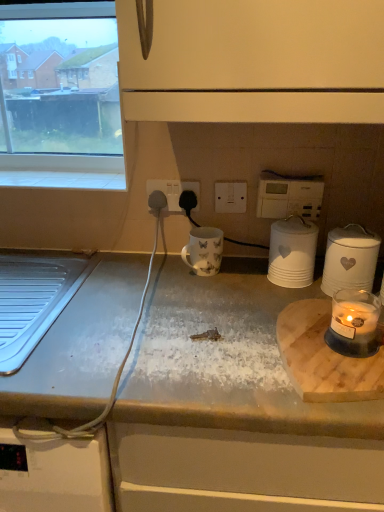
Question: Is white marble countertop at center at the right side of white ceramic jar at right, which ranks as the first kitchen appliance in right-to-left order?

Choices:
 (A) yes
 (B) no

Answer: (B)

Question: Does white marble countertop at center have a larger size compared to white ceramic jar at right, which ranks as the second kitchen appliance in left-to-right order?

Choices:
 (A) yes
 (B) no

Answer: (A)

Question: Considering the relative sizes of white marble countertop at center and white ceramic jar at right, which ranks as the first kitchen appliance in right-to-left order, in the image provided, is white marble countertop at center shorter than white ceramic jar at right, which ranks as the first kitchen appliance in right-to-left order,?

Choices:
 (A) no
 (B) yes

Answer: (A)

Question: Is white marble countertop at center behind white ceramic jar at right, which ranks as the second kitchen appliance in left-to-right order?

Choices:
 (A) no
 (B) yes

Answer: (A)

Question: Is white marble countertop at center to the left of white ceramic jar at right, which ranks as the second kitchen appliance in left-to-right order, from the viewer's perspective?

Choices:
 (A) no
 (B) yes

Answer: (B)

Question: Is white ceramic jar at right, which ranks as the first kitchen appliance in right-to-left order, in front of or behind white glossy mug at center in the image?

Choices:
 (A) front
 (B) behind

Answer: (A)

Question: Is white ceramic jar at right, which ranks as the first kitchen appliance in right-to-left order, spatially inside white glossy mug at center, or outside of it?

Choices:
 (A) outside
 (B) inside

Answer: (A)

Question: From the image's perspective, is white ceramic jar at right, which ranks as the second kitchen appliance in left-to-right order, positioned above or below white glossy mug at center?

Choices:
 (A) below
 (B) above

Answer: (A)

Question: Looking at their shapes, would you say white ceramic jar at right, which ranks as the first kitchen appliance in right-to-left order, is wider or thinner than white glossy mug at center?

Choices:
 (A) thin
 (B) wide

Answer: (A)

Question: Considering the positions of point (274, 241) and point (223, 181), is point (274, 241) closer or farther from the camera than point (223, 181)?

Choices:
 (A) farther
 (B) closer

Answer: (B)

Question: Based on their sizes in the image, would you say white matte canister at center-right, placed as the second kitchen appliance when sorted from right to left, is bigger or smaller than white plastic switch at center, placed as the 1th electric outlet when sorted from right to left?

Choices:
 (A) big
 (B) small

Answer: (A)

Question: Looking at their shapes, would you say white matte canister at center-right, placed as the second kitchen appliance when sorted from right to left, is wider or thinner than white plastic switch at center, placed as the 1th electric outlet when sorted from right to left?

Choices:
 (A) wide
 (B) thin

Answer: (A)

Question: From a real-world perspective, relative to white plastic switch at center, placed as the 1th electric outlet when sorted from right to left, is white matte canister at center-right, placed as the second kitchen appliance when sorted from right to left, vertically above or below?

Choices:
 (A) below
 (B) above

Answer: (A)

Question: From the image's perspective, is white plastic socket at center, the first electric outlet when ordered from left to right, located above or below white matte canister at center-right, placed as the second kitchen appliance when sorted from right to left?

Choices:
 (A) above
 (B) below

Answer: (A)

Question: Based on their sizes in the image, would you say white plastic socket at center, the first electric outlet when ordered from left to right, is bigger or smaller than white matte canister at center-right, the first kitchen appliance when ordered from left to right?

Choices:
 (A) small
 (B) big

Answer: (A)